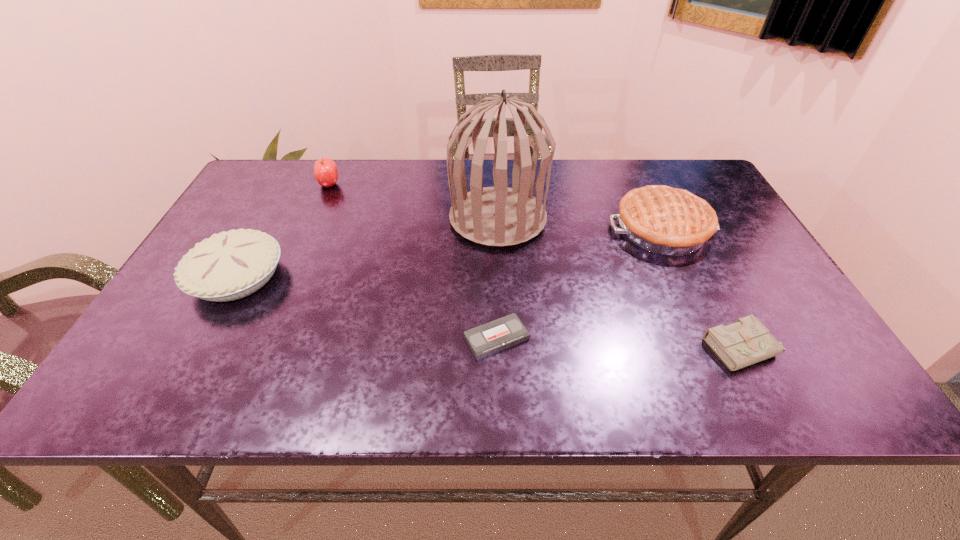
The height and width of the screenshot is (540, 960). Find the location of `object positioned at the near right corner`. object positioned at the near right corner is located at coordinates (747, 341).

Where is `vacant space at the far edge of the desktop`? vacant space at the far edge of the desktop is located at coordinates (312, 177).

Identify the location of free location at the near edge of the desktop. (364, 378).

This screenshot has height=540, width=960. What are the coordinates of `free region at the left edge of the desktop` in the screenshot? It's located at (275, 217).

This screenshot has height=540, width=960. In order to click on free space at the far left corner of the desktop in this screenshot , I will do `click(266, 183)`.

In the image, there is a desktop. Identify the location of vacant area at the near left corner. (168, 382).

Where is `free space at the near right corner of the desktop`? The height and width of the screenshot is (540, 960). free space at the near right corner of the desktop is located at coordinates (831, 403).

I want to click on free space that is in between the tallest object and the fifth tallest object, so click(621, 283).

Locate an element on the screen. This screenshot has height=540, width=960. free space between the tallest object and the shorter pie is located at coordinates (368, 247).

The width and height of the screenshot is (960, 540). Identify the location of empty space that is in between the tallest object and the videotape. (497, 278).